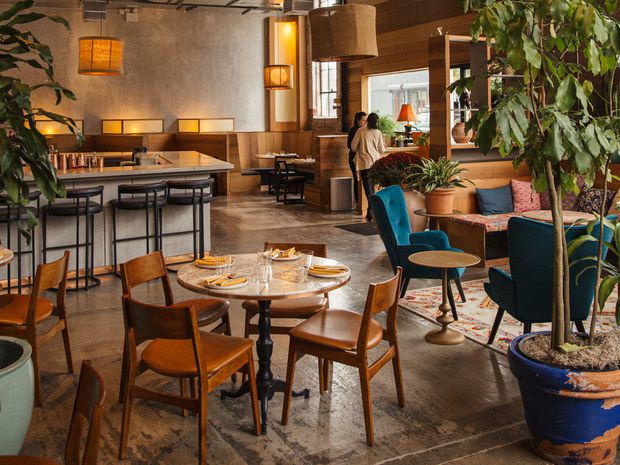
This screenshot has width=620, height=465. Identify the location of lights. (99, 45), (277, 76), (343, 40), (222, 117), (129, 119), (58, 124), (405, 110).